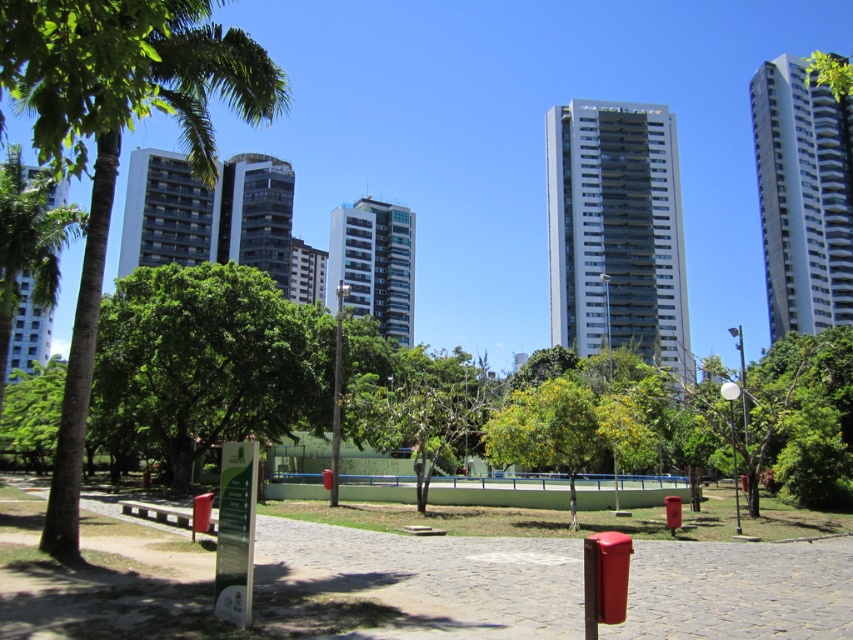
Who is shorter, green leafy palm tree at left or white glass building at center?

green leafy palm tree at left

Who is taller, green leafy palm tree at left or white glass building at center?

With more height is white glass building at center.

Between point (137, 26) and point (660, 308), which one is positioned in front?

Positioned in front is point (137, 26).

Find the location of `green leafy palm tree at left`. green leafy palm tree at left is located at coordinates (119, 141).

Is white smooth building at upper right to the right of smooth glass building at center from the viewer's perspective?

Indeed, white smooth building at upper right is positioned on the right side of smooth glass building at center.

Is white smooth building at upper right to the left of smooth glass building at center from the viewer's perspective?

No, white smooth building at upper right is not to the left of smooth glass building at center.

Identify the location of white smooth building at upper right. (802, 196).

Can you confirm if white smooth building at upper right is taller than glassy steel building at center?

Yes.

Who is lower down, white smooth building at upper right or glassy steel building at center?

glassy steel building at center is below.

Is point (805, 259) positioned after point (386, 289)?

No.

What are the coordinates of `white smooth building at upper right` in the screenshot? It's located at (802, 196).